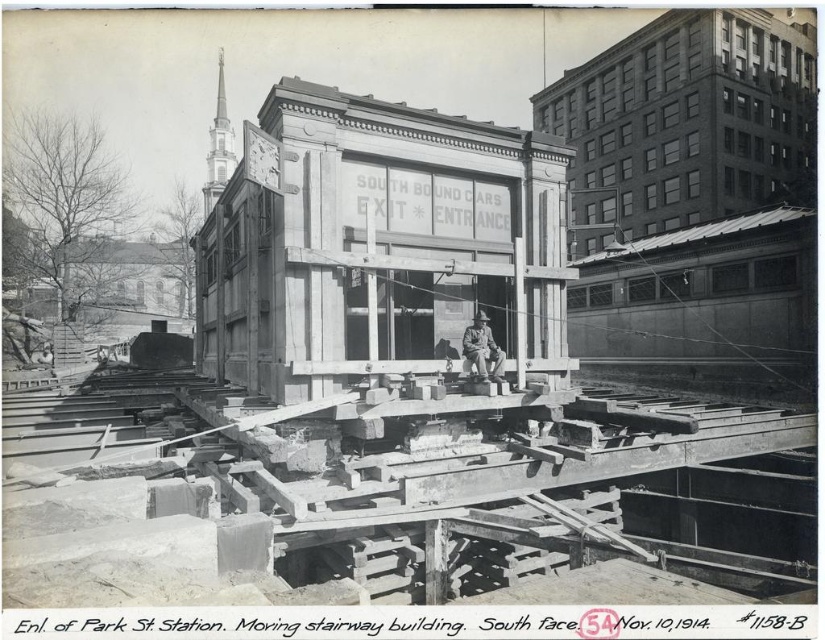
Question: Does wooden beams at center come in front of camouflage fabric uniform at center?

Choices:
 (A) no
 (B) yes

Answer: (B)

Question: Does wooden beams at center appear on the left side of camouflage fabric uniform at center?

Choices:
 (A) no
 (B) yes

Answer: (B)

Question: Can you confirm if wooden beams at center is positioned below camouflage fabric uniform at center?

Choices:
 (A) no
 (B) yes

Answer: (B)